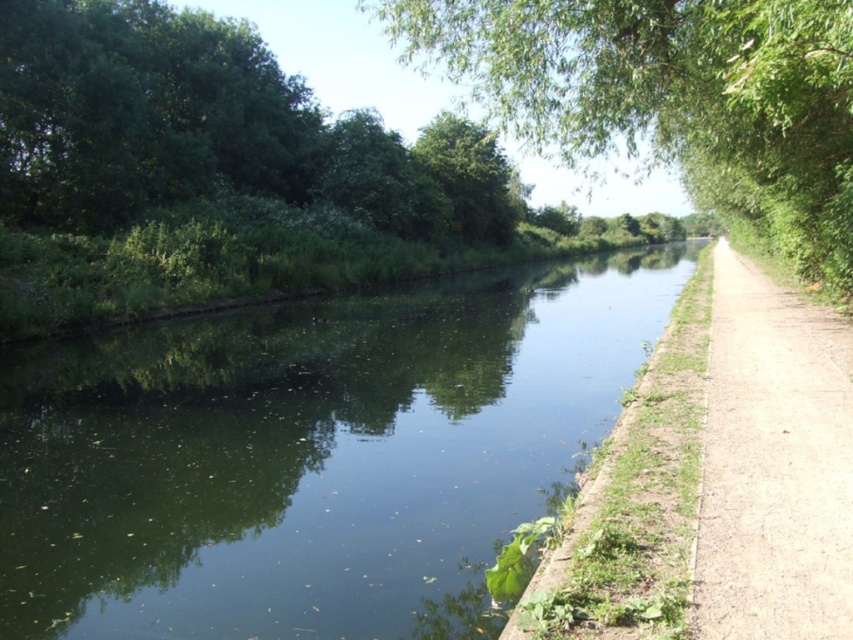
Can you confirm if green leafy tree at center is smaller than dirt path at right?

Actually, green leafy tree at center might be larger than dirt path at right.

Locate an element on the screen. This screenshot has height=640, width=853. green leafy tree at center is located at coordinates (672, 99).

Where is `green leafy tree at center`? This screenshot has width=853, height=640. green leafy tree at center is located at coordinates (672, 99).

Does point (129, 637) come in front of point (738, 436)?

Yes, it is in front of point (738, 436).

Looking at this image, between green reflective water at center and dirt path at right, which one appears on the right side from the viewer's perspective?

dirt path at right is more to the right.

Is point (548, 308) in front of point (743, 394)?

No, it is behind (743, 394).

This screenshot has width=853, height=640. Identify the location of green reflective water at center. (312, 454).

Between green reflective water at center and green leafy tree at center, which one is positioned lower?

green reflective water at center is lower down.

Between point (305, 353) and point (724, 20), which one is positioned behind?

The point (305, 353) is behind.

Between point (378, 557) and point (547, 52), which one is positioned behind?

Point (547, 52)

Image resolution: width=853 pixels, height=640 pixels. In order to click on green reflective water at center in this screenshot , I will do `click(312, 454)`.